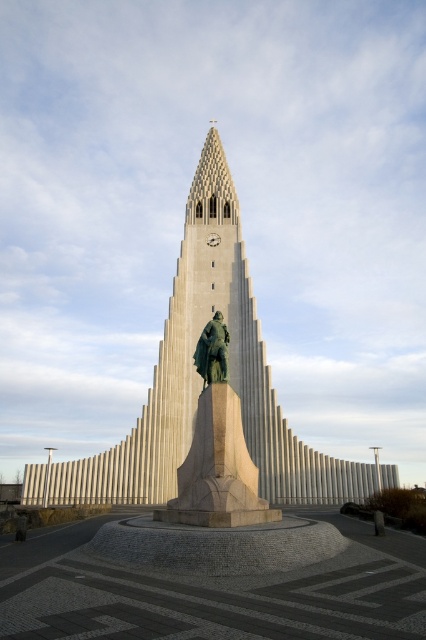
Does light gray stone tower at center appear under green polished stone statue at center?

No.

Is light gray stone tower at center positioned in front of green polished stone statue at center?

No.

Who is more forward, (190,408) or (226,451)?

Positioned in front is point (226,451).

Locate an element on the screen. light gray stone tower at center is located at coordinates (201, 378).

Based on the photo, does light gray stone tower at center appear on the left side of bronze statue at center?

Incorrect, light gray stone tower at center is not on the left side of bronze statue at center.

Is light gray stone tower at center smaller than bronze statue at center?

Actually, light gray stone tower at center might be larger than bronze statue at center.

Is point (261, 413) less distant than point (221, 317)?

No, (261, 413) is further to viewer.

The image size is (426, 640). What are the coordinates of `light gray stone tower at center` in the screenshot? It's located at 201,378.

Is green polished stone statue at center wider than bronze statue at center?

Yes.

Can you confirm if green polished stone statue at center is shorter than bronze statue at center?

Incorrect, green polished stone statue at center's height does not fall short of bronze statue at center's.

Which is in front, point (187, 481) or point (215, 353)?

Point (187, 481)

The image size is (426, 640). In order to click on green polished stone statue at center in this screenshot , I will do `click(216, 449)`.